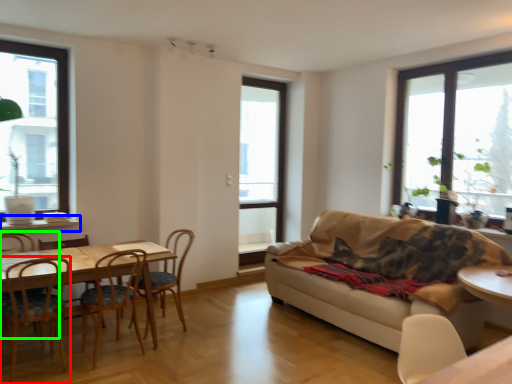
Question: Which object is positioned closest to chair (highlighted by a red box)? Select from window sill (highlighted by a blue box) and chair (highlighted by a green box).

Choices:
 (A) window sill
 (B) chair

Answer: (B)